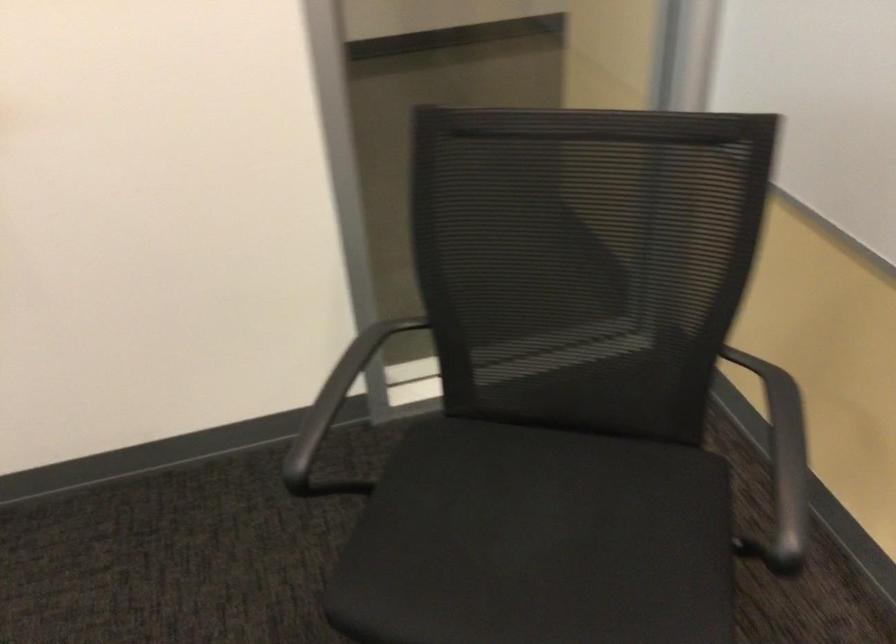
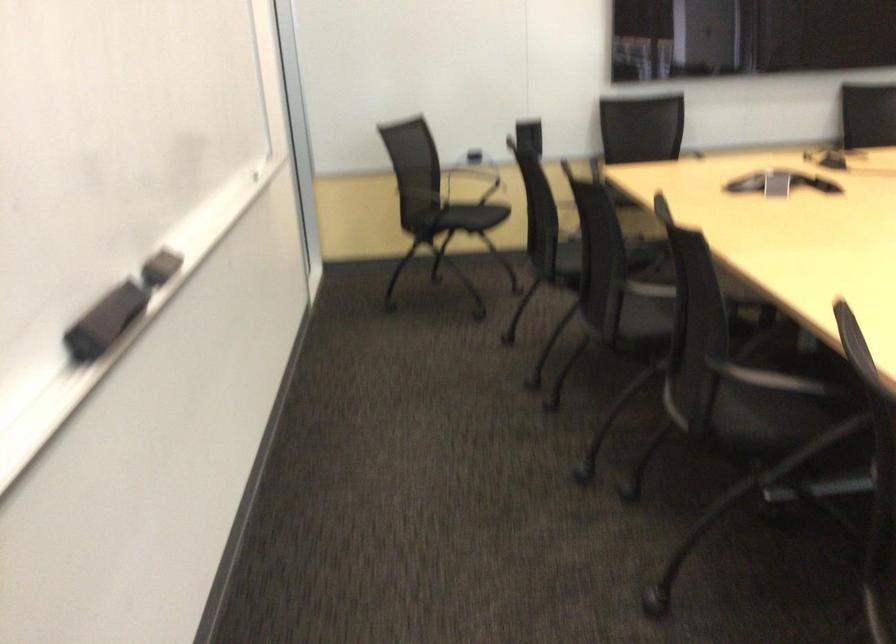
The point at (495, 477) is marked in the first image. Where is the corresponding point in the second image?

(448, 216)